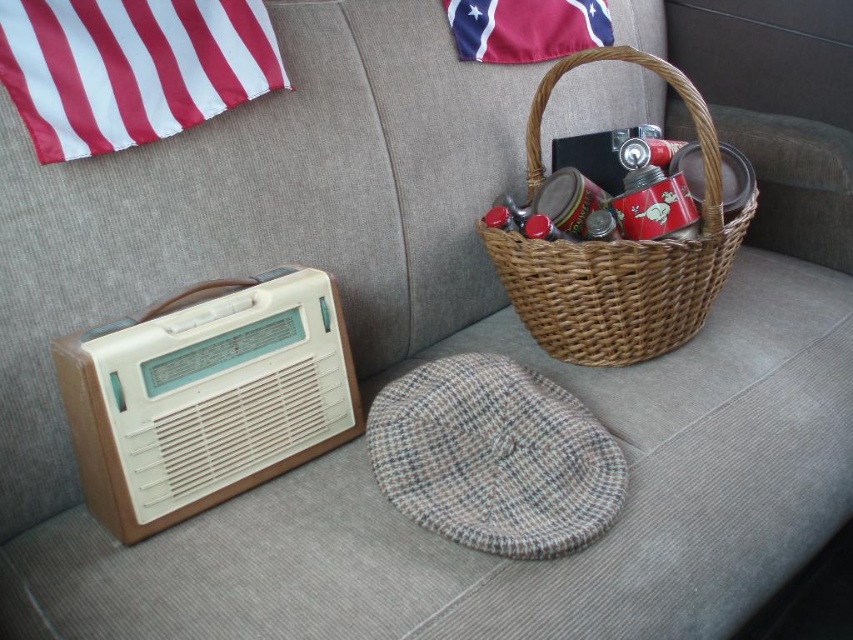
Question: Observing the image, what is the correct spatial positioning of woven brown basket at center in reference to red cotton flag at upper center?

Choices:
 (A) left
 (B) right

Answer: (B)

Question: Can you confirm if red/white striped fabric at upper left is wider than red cotton flag at upper center?

Choices:
 (A) yes
 (B) no

Answer: (B)

Question: Is red/white striped fabric at upper left above red cotton flag at upper center?

Choices:
 (A) yes
 (B) no

Answer: (B)

Question: Among these objects, which one is farthest from the camera?

Choices:
 (A) woven brown basket at center
 (B) red cotton flag at upper center
 (C) red/white striped fabric at upper left

Answer: (B)

Question: Which of the following is the farthest from the observer?

Choices:
 (A) red/white striped fabric at upper left
 (B) woven brown basket at center

Answer: (B)

Question: Among these points, which one is nearest to the camera?

Choices:
 (A) (527, 241)
 (B) (611, 33)
 (C) (242, 68)

Answer: (C)